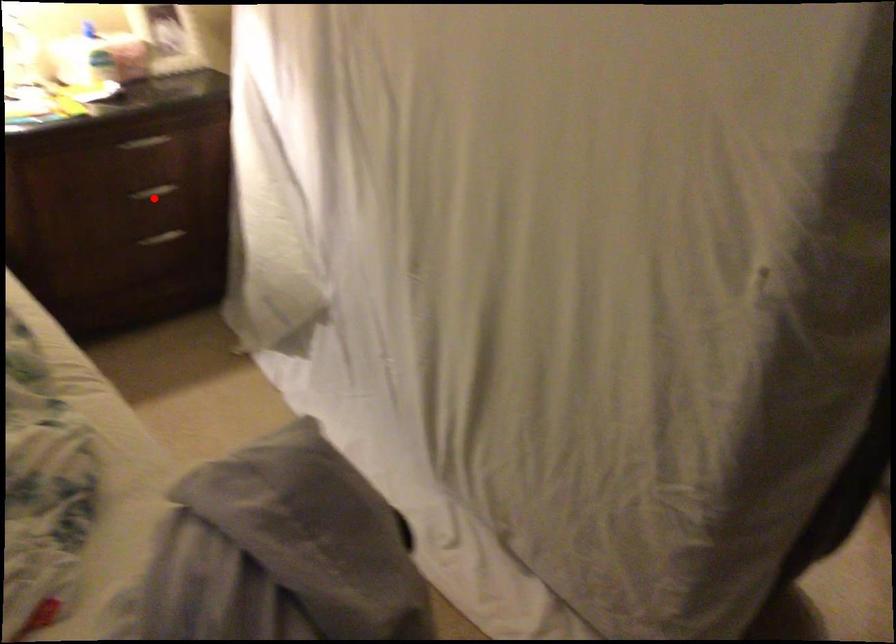
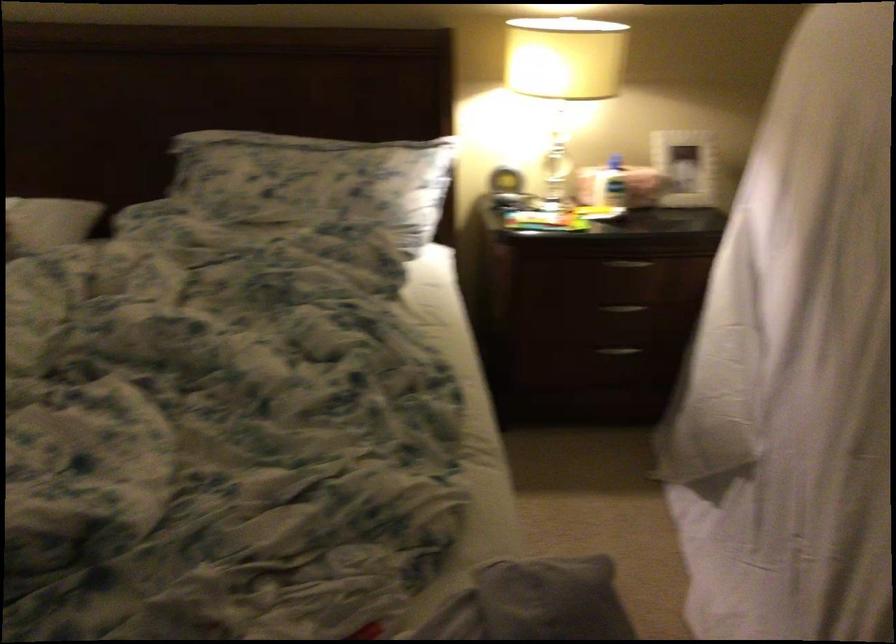
The point at the highlighted location is marked in the first image. Where is the corresponding point in the second image?

(624, 308)